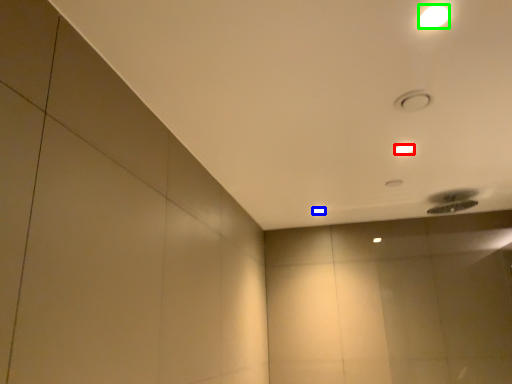
Question: Based on their relative distances, which object is nearer to lamp (highlighted by a red box)? Choose from lamp (highlighted by a blue box) and lamp (highlighted by a green box).

Choices:
 (A) lamp
 (B) lamp

Answer: (B)